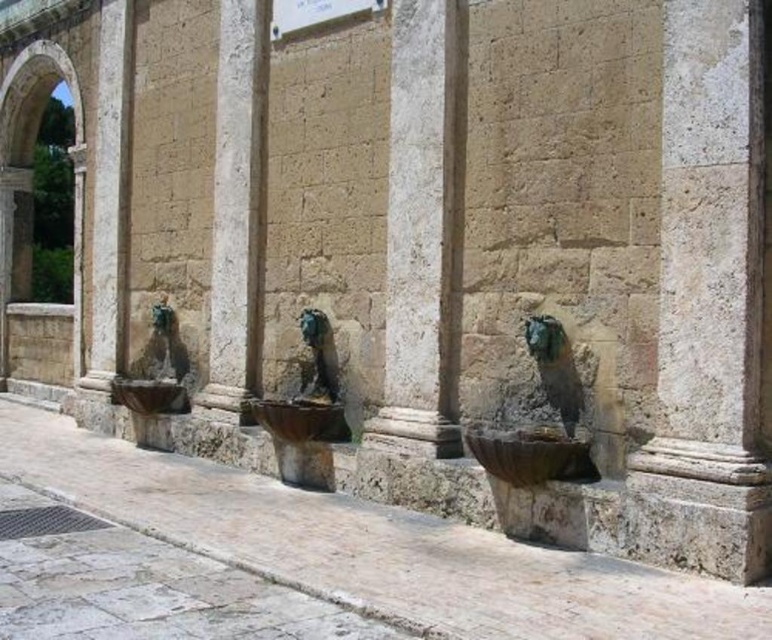
You are an architect analyzing the layout of an ancient stone structure. You need to place a new decorative element exactly at the center of the white stone column at center. What are the coordinates where you should place it?

The coordinates for the white stone column at center are at point (x=422, y=228), so you should place the new decorative element exactly at those coordinates.

You are standing in front of an ancient stone wall with two points marked on it. The first point is at coordinates point (x=417, y=368) and the second is at point (x=171, y=339). Which point is closer to you?

Point (x=417, y=368) is in front of point (x=171, y=339), so it is closer to you.

You are an architect designing a new garden and want to place the smooth stone column at center and the green stone fountain at center in your design. Which object should you choose if you want the one that is wider?

The smooth stone column at center might be wider than green stone fountain at center, so you should choose the smooth stone column at center if you want the wider one.